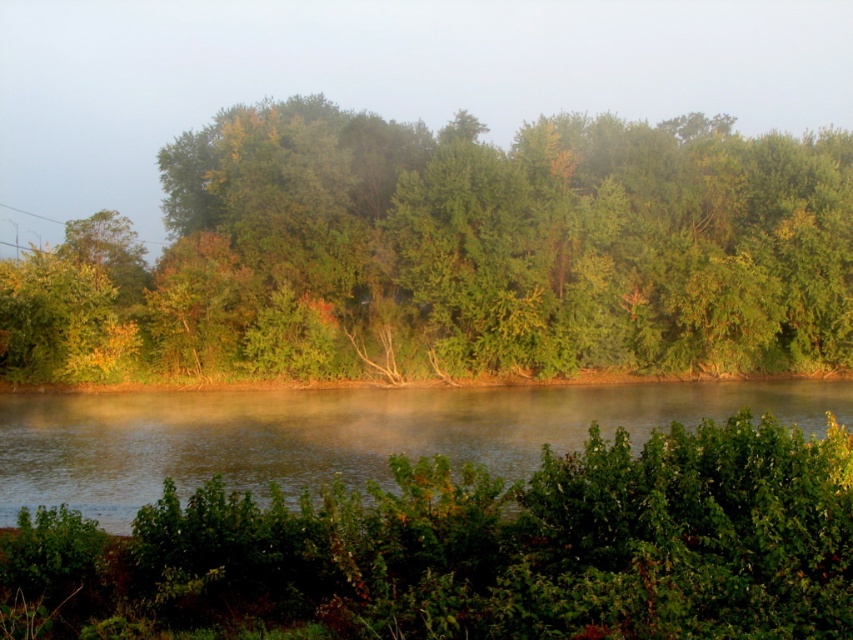
You are standing at the riverside and want to take a photo of the green matte trees at center and smooth water at center. Based on the scene, which object is closer to the camera?

The green matte trees at center are positioned over the smooth water at center, meaning they are closer to the camera.

You are an artist planning to paint this riverside scene. You have limited canvas space and must decide which element to emphasize more between the green matte trees at center and the foggy mist at upper center. Based on the scene, which element should you focus on and why?

The foggy mist at upper center occupies more space than the green matte trees at center, so you should focus on emphasizing the foggy mist at upper center in your painting to accurately represent their prominence in the scene.

You are an observer standing at the riverside. You notice the foggy mist at upper center and the smooth water at center. Which object is positioned higher in the scene?

The foggy mist at upper center is located above the smooth water at center, so it is positioned higher in the scene.